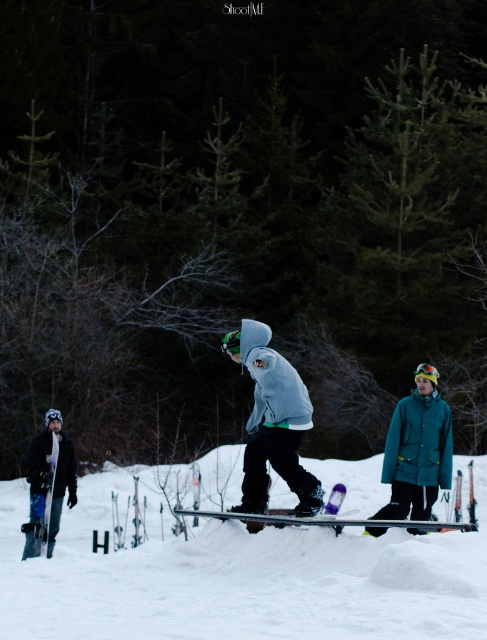
Does matte gray hoodie at center appear on the right side of matte purple snowboard at lower left?

Yes, matte gray hoodie at center is to the right of matte purple snowboard at lower left.

Can you confirm if matte gray hoodie at center is positioned below matte purple snowboard at lower left?

No.

Locate an element on the screen. matte gray hoodie at center is located at coordinates pyautogui.click(x=273, y=420).

Between point (292, 618) and point (250, 432), which one is positioned in front?

Point (292, 618)

Is white fluffy snow at center shorter than matte gray hoodie at center?

Correct, white fluffy snow at center is not as tall as matte gray hoodie at center.

Locate an element on the screen. This screenshot has width=487, height=640. white fluffy snow at center is located at coordinates (237, 577).

Which is more to the right, white fluffy snow at center or matte purple snowboard at lower left?

white fluffy snow at center

Between point (0, 637) and point (54, 444), which one is positioned in front?

Positioned in front is point (0, 637).

You are a GUI agent. You are given a task and a screenshot of the screen. Output one action in this format:
    pyautogui.click(x=<x>, y=<y>)
    Task: Click on the white fluffy snow at center
    This screenshot has width=487, height=640.
    Given the screenshot: What is the action you would take?
    pyautogui.click(x=237, y=577)